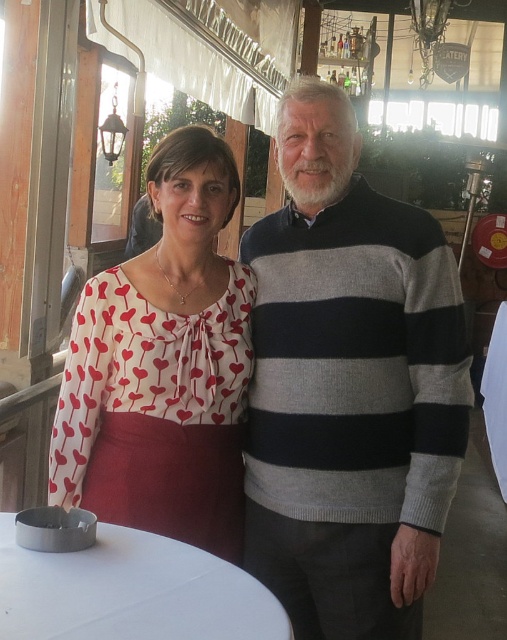
Does point (0, 570) come farther from viewer compared to point (213, 451)?

No, it is in front of (213, 451).

Is white glossy round table at lower left above red cotton apron at lower left?

No.

This screenshot has height=640, width=507. What do you see at coordinates (129, 592) in the screenshot?
I see `white glossy round table at lower left` at bounding box center [129, 592].

Locate an element on the screen. This screenshot has height=640, width=507. white glossy round table at lower left is located at coordinates (129, 592).

Can you confirm if striped sweater at center is positioned below white glossy round table at lower left?

No.

How much distance is there between striped sweater at center and white glossy round table at lower left?

striped sweater at center is 26.74 inches away from white glossy round table at lower left.

Does point (354, 444) lie in front of point (193, 614)?

That is False.

This screenshot has width=507, height=640. I want to click on striped sweater at center, so click(x=348, y=387).

Is striped sweater at center positioned in front of white printed blouse at center?

Yes, striped sweater at center is in front of white printed blouse at center.

Which is below, striped sweater at center or white printed blouse at center?

striped sweater at center is below.

Does point (337, 476) lie in front of point (162, 435)?

Yes.

The height and width of the screenshot is (640, 507). I want to click on striped sweater at center, so click(x=348, y=387).